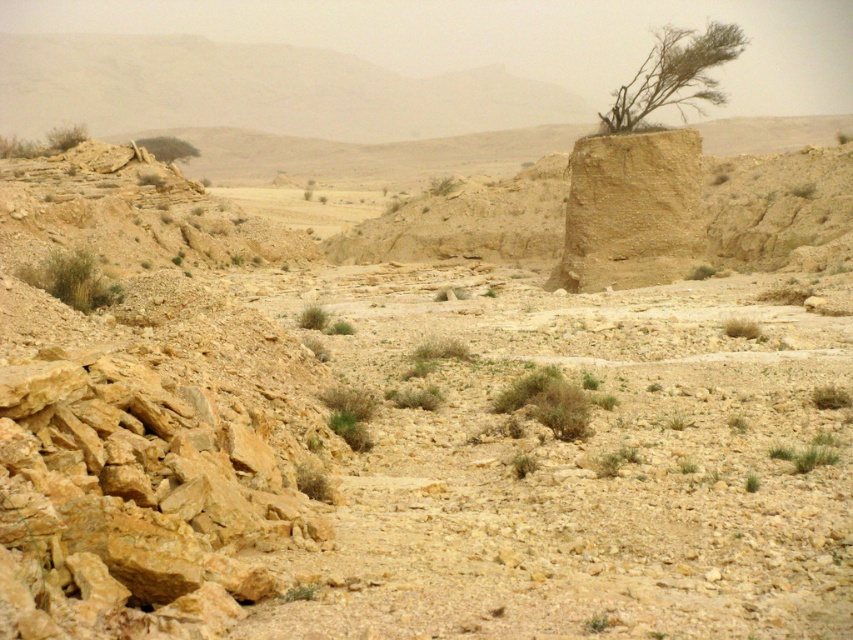
Question: Is rusty stone boulder at lower left above brown clay rock at center?

Choices:
 (A) yes
 (B) no

Answer: (B)

Question: Which object is positioned closest to the rusty stone boulder at lower left?

Choices:
 (A) green grassy bush at lower left
 (B) green leafy tree at upper left
 (C) desert sand hillside at upper left

Answer: (A)

Question: Which of the following is the closest to the observer?

Choices:
 (A) (392, 138)
 (B) (141, 141)

Answer: (B)

Question: Does dry shrub at upper center come behind green grassy bush at lower left?

Choices:
 (A) yes
 (B) no

Answer: (A)

Question: Considering the real-world distances, which object is farthest from the green leafy tree at upper left?

Choices:
 (A) desert sand hillside at upper left
 (B) rusty stone boulder at lower left
 (C) green grassy bush at lower left

Answer: (B)

Question: Does dry shrub at upper center appear on the right side of green leafy tree at upper left?

Choices:
 (A) no
 (B) yes

Answer: (B)